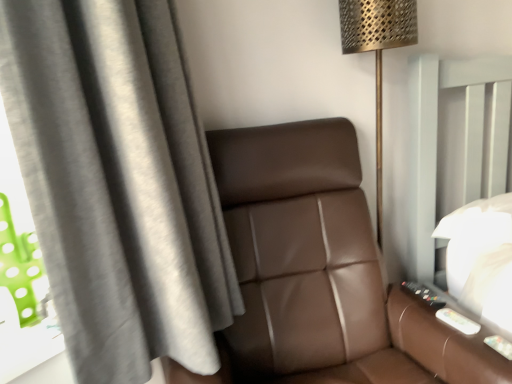
Question: From the image's perspective, is gray fabric curtain at left on top of brown leather chair at center?

Choices:
 (A) no
 (B) yes

Answer: (B)

Question: Does gray fabric curtain at left lie in front of brown leather chair at center?

Choices:
 (A) no
 (B) yes

Answer: (A)

Question: Is gray fabric curtain at left outside of brown leather chair at center?

Choices:
 (A) yes
 (B) no

Answer: (A)

Question: From a real-world perspective, is gray fabric curtain at left physically above brown leather chair at center?

Choices:
 (A) yes
 (B) no

Answer: (A)

Question: Is gray fabric curtain at left further to camera compared to brown leather chair at center?

Choices:
 (A) no
 (B) yes

Answer: (B)

Question: Is gray fabric curtain at left positioned with its back to brown leather chair at center?

Choices:
 (A) no
 (B) yes

Answer: (B)

Question: Is brown leather chair at center positioned with its back to metallic gold floor lamp at upper right?

Choices:
 (A) no
 (B) yes

Answer: (B)

Question: Is brown leather chair at center positioned far away from metallic gold floor lamp at upper right?

Choices:
 (A) no
 (B) yes

Answer: (A)

Question: From a real-world perspective, is brown leather chair at center located beneath metallic gold floor lamp at upper right?

Choices:
 (A) yes
 (B) no

Answer: (A)

Question: Considering the relative sizes of brown leather chair at center and metallic gold floor lamp at upper right in the image provided, is brown leather chair at center bigger than metallic gold floor lamp at upper right?

Choices:
 (A) yes
 (B) no

Answer: (A)

Question: Can we say brown leather chair at center lies outside metallic gold floor lamp at upper right?

Choices:
 (A) yes
 (B) no

Answer: (A)

Question: Can you confirm if brown leather chair at center is positioned to the right of metallic gold floor lamp at upper right?

Choices:
 (A) yes
 (B) no

Answer: (B)

Question: Is metallic gold floor lamp at upper right to the right of gray fabric curtain at left from the viewer's perspective?

Choices:
 (A) yes
 (B) no

Answer: (A)